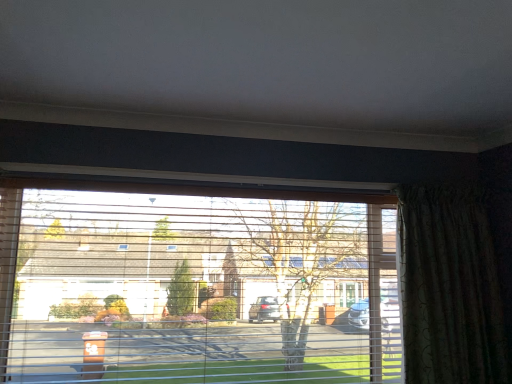
This screenshot has height=384, width=512. What do you see at coordinates (449, 287) in the screenshot? I see `green textured curtain at right` at bounding box center [449, 287].

I want to click on green textured curtain at right, so click(x=449, y=287).

The image size is (512, 384). I want to click on transparent plastic window at center, so click(x=195, y=290).

What is the approximate height of transparent plastic window at center?

1.35 meters.

Describe the element at coordinates (195, 290) in the screenshot. The width and height of the screenshot is (512, 384). I see `transparent plastic window at center` at that location.

Locate an element on the screen. This screenshot has height=384, width=512. green textured curtain at right is located at coordinates (449, 287).

Consider the image. Can you confirm if transparent plastic window at center is positioned to the right of green textured curtain at right?

Incorrect, transparent plastic window at center is not on the right side of green textured curtain at right.

In the scene shown: Which object is further away from the camera, transparent plastic window at center or green textured curtain at right?

green textured curtain at right.

Which is in front, point (371, 239) or point (477, 359)?

The point (477, 359) is more forward.

From the image's perspective, is transparent plastic window at center above or below green textured curtain at right?

Clearly, from the image's perspective, transparent plastic window at center is below green textured curtain at right.

From a real-world perspective, is transparent plastic window at center on green textured curtain at right?

No, from a real-world perspective, transparent plastic window at center is not over green textured curtain at right

Considering the relative sizes of transparent plastic window at center and green textured curtain at right in the image provided, is transparent plastic window at center thinner than green textured curtain at right?

No.

Which of these two, transparent plastic window at center or green textured curtain at right, stands shorter?

Standing shorter between the two is green textured curtain at right.

Can you confirm if transparent plastic window at center is bigger than green textured curtain at right?

Correct, transparent plastic window at center is larger in size than green textured curtain at right.

Is transparent plastic window at center outside of green textured curtain at right?

transparent plastic window at center is positioned outside green textured curtain at right.

Is transparent plastic window at center not close to green textured curtain at right?

transparent plastic window at center is near green textured curtain at right, not far away.

Could you tell me if transparent plastic window at center is facing green textured curtain at right?

No.

How different are the orientations of transparent plastic window at center and green textured curtain at right in degrees?

0.837 degrees.

In order to click on curtain behind the transparent plastic window at center in this screenshot , I will do `click(449, 287)`.

Is green textured curtain at right at the right side of transparent plastic window at center?

Correct, you'll find green textured curtain at right to the right of transparent plastic window at center.

Which object is further away from the camera, green textured curtain at right or transparent plastic window at center?

green textured curtain at right is further away from the camera.

Is point (493, 282) less distant than point (184, 280)?

No.

From the image's perspective, which is below, green textured curtain at right or transparent plastic window at center?

transparent plastic window at center appears lower in the image.

From a real-world perspective, who is located lower, green textured curtain at right or transparent plastic window at center?

transparent plastic window at center.

Considering the relative sizes of green textured curtain at right and transparent plastic window at center in the image provided, is green textured curtain at right thinner than transparent plastic window at center?

Yes, green textured curtain at right is thinner than transparent plastic window at center.

Does green textured curtain at right have a greater height compared to transparent plastic window at center?

Incorrect, the height of green textured curtain at right is not larger of that of transparent plastic window at center.

Is green textured curtain at right bigger or smaller than transparent plastic window at center?

green textured curtain at right is smaller than transparent plastic window at center.

Is transparent plastic window at center surrounded by green textured curtain at right?

No, transparent plastic window at center is located outside of green textured curtain at right.

Is green textured curtain at right not near transparent plastic window at center?

No, green textured curtain at right is in close proximity to transparent plastic window at center.

Is green textured curtain at right facing away from transparent plastic window at center?

No.

Can you tell me how much green textured curtain at right and transparent plastic window at center differ in facing direction?

They differ by 0.837 degrees in their facing directions.

This screenshot has width=512, height=384. In order to click on curtain located behind the transparent plastic window at center in this screenshot , I will do `click(449, 287)`.

Image resolution: width=512 pixels, height=384 pixels. What are the coordinates of `window on the left of green textured curtain at right` in the screenshot? It's located at (195, 290).

In order to click on window in front of the green textured curtain at right in this screenshot , I will do `click(195, 290)`.